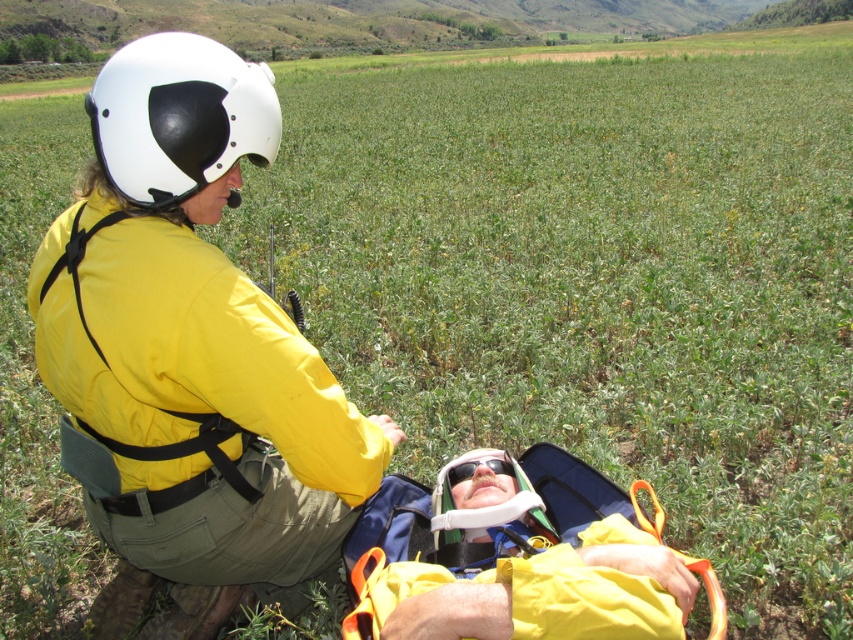
Question: Considering the real-world distances, which object is farthest from the black plastic goggles at center?

Choices:
 (A) white matte helmet at upper left
 (B) yellow fabric at center

Answer: (A)

Question: Is yellow fabric at center below black plastic goggles at center?

Choices:
 (A) yes
 (B) no

Answer: (A)

Question: Which point is farther to the camera?

Choices:
 (A) (488, 465)
 (B) (376, 582)

Answer: (A)

Question: Can you confirm if yellow fabric at center is bigger than black plastic goggles at center?

Choices:
 (A) yes
 (B) no

Answer: (A)

Question: Does yellow fabric at center have a smaller size compared to black plastic goggles at center?

Choices:
 (A) yes
 (B) no

Answer: (B)

Question: Based on their relative distances, which object is farther from the black plastic goggles at center?

Choices:
 (A) yellow fabric at center
 (B) white matte helmet at upper left

Answer: (B)